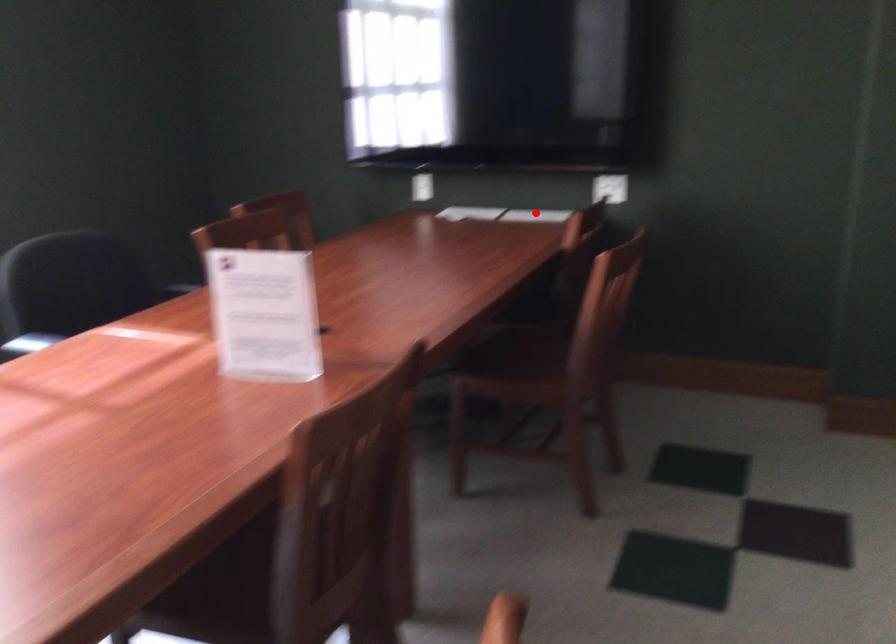
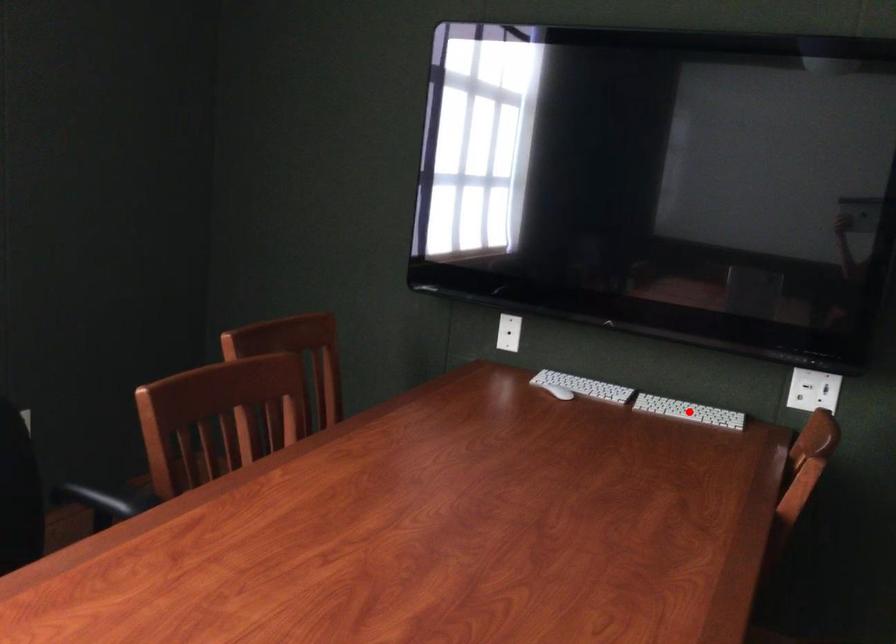
I am providing you with two images of the same scene from different viewpoints. A red point is marked on the first image and another point is marked on the second image. Are the points marked in image1 and image2 representing the same 3D position?

Yes